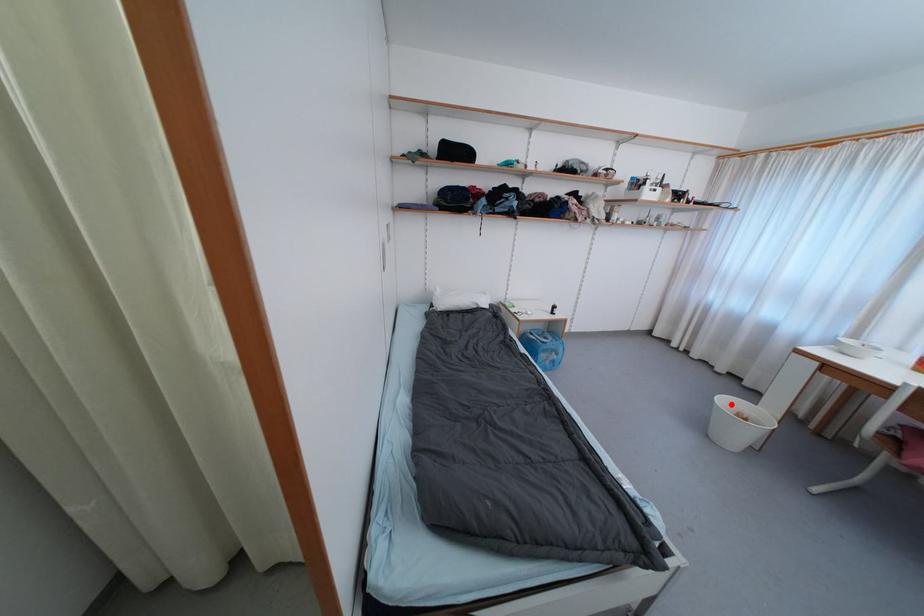
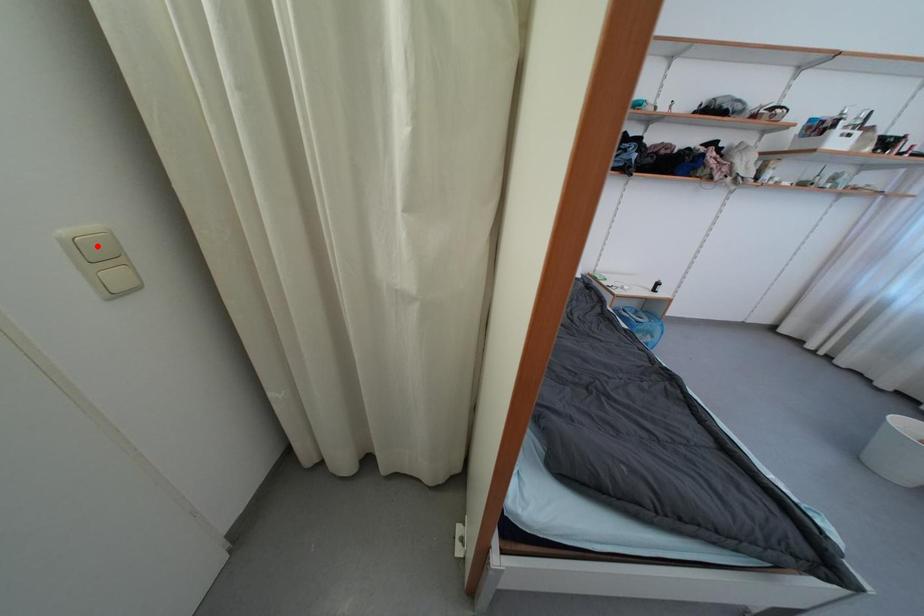
I am providing you with two images of the same scene from different viewpoints. A red point is marked on the first image and another point is marked on the second image. Does the point marked in image1 correspond to the same location as the one in image2?

No